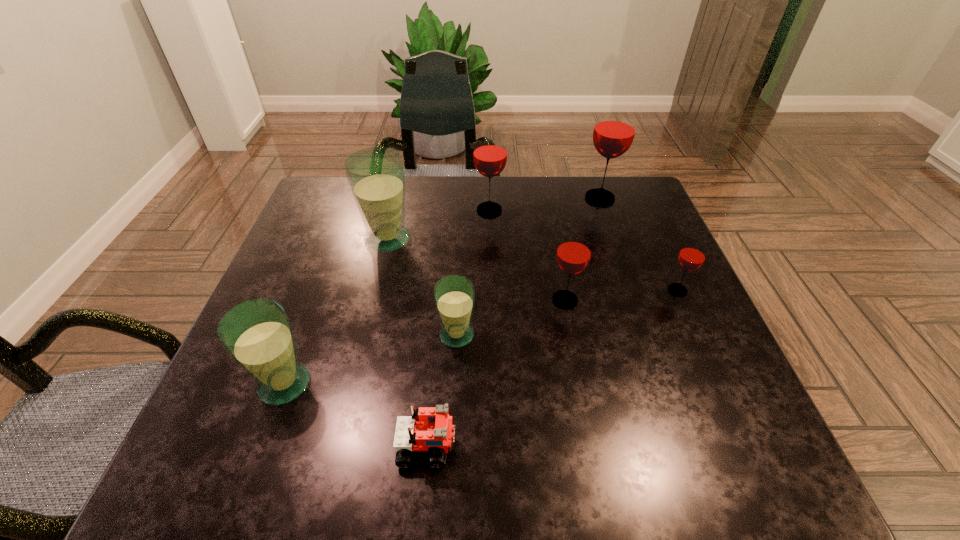
The width and height of the screenshot is (960, 540). I want to click on the tallest glass, so click(x=614, y=131).

Locate an element on the screen. the seventh object from left to right is located at coordinates (614, 131).

In order to click on the third smallest red glass in this screenshot , I will do `click(490, 154)`.

Locate an element on the screen. The width and height of the screenshot is (960, 540). the second blue glass from left to right is located at coordinates (376, 175).

Identify the location of the fifth nearest glass. The height and width of the screenshot is (540, 960). (376, 175).

Locate an element on the screen. the sixth object from left to right is located at coordinates (573, 255).

The height and width of the screenshot is (540, 960). What are the coordinates of `the fifth glass from left to right` in the screenshot? It's located at tap(573, 255).

Where is `the leftmost glass`? the leftmost glass is located at coordinates (257, 334).

Locate an element on the screen. This screenshot has width=960, height=540. the seventh farthest object is located at coordinates (257, 334).

At what (x,y) coordinates should I click in order to perform the action: click on the smallest red glass. Please return your answer as a coordinate pair (x, y). Looking at the image, I should click on (692, 255).